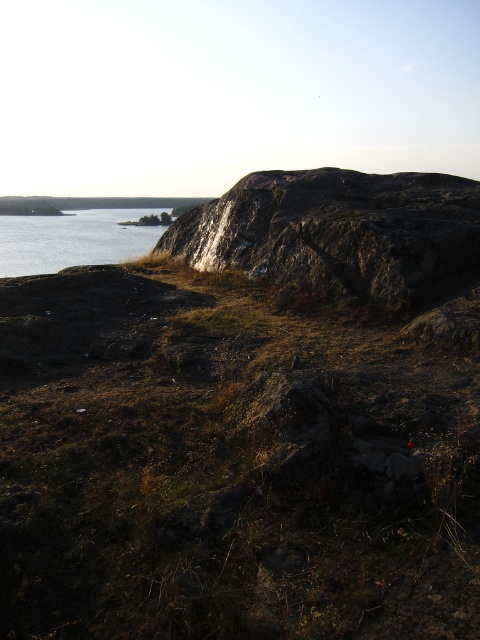
You are a hiker trying to navigate the terrain. You need to cross from the rough granite rock at upper right to the blue water at left. Which object is shorter in height, making it easier to step onto from the other?

The rough granite rock at upper right has a lesser height compared to blue water at left, so it is shorter and easier to step onto from the blue water at left.

You are planning to place a small garden statue exactly between the rough granite rock at upper right and the blue water at left. Considering their widths, which object will have more space between them and the statue?

The blue water at left will have more space between it and the statue because the rough granite rock at upper right has a lesser width compared to blue water at left, meaning the statue will be closer to the narrower rough granite rock at upper right.